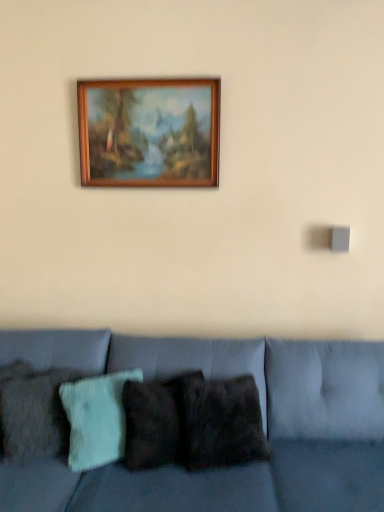
Question: Which direction should I rotate to face textured teal pillow at center, which appears as the second pillow when viewed from the left, — up or down?

Choices:
 (A) down
 (B) up

Answer: (A)

Question: Considering the relative positions of wooden picture frame at upper center and textured teal pillow at center, which appears as the second pillow when viewed from the left, in the image provided, is wooden picture frame at upper center behind textured teal pillow at center, which appears as the second pillow when viewed from the left,?

Choices:
 (A) yes
 (B) no

Answer: (A)

Question: From the image's perspective, is wooden picture frame at upper center beneath textured teal pillow at center, the 2th pillow in the right-to-left sequence?

Choices:
 (A) no
 (B) yes

Answer: (A)

Question: Can you confirm if wooden picture frame at upper center is taller than textured teal pillow at center, the 2th pillow in the right-to-left sequence?

Choices:
 (A) yes
 (B) no

Answer: (A)

Question: Does wooden picture frame at upper center turn towards textured teal pillow at center, the 2th pillow in the right-to-left sequence?

Choices:
 (A) yes
 (B) no

Answer: (B)

Question: From a real-world perspective, is wooden picture frame at upper center positioned over textured teal pillow at center, which appears as the second pillow when viewed from the left, based on gravity?

Choices:
 (A) no
 (B) yes

Answer: (B)

Question: Considering the relative sizes of wooden picture frame at upper center and textured teal pillow at center, which appears as the second pillow when viewed from the left, in the image provided, is wooden picture frame at upper center smaller than textured teal pillow at center, which appears as the second pillow when viewed from the left,?

Choices:
 (A) yes
 (B) no

Answer: (A)

Question: Would you say textured woolen pillow at left, acting as the third pillow starting from the right, contains velvet blue couch at lower center?

Choices:
 (A) no
 (B) yes

Answer: (A)

Question: Considering the relative sizes of textured woolen pillow at left, acting as the third pillow starting from the right, and velvet blue couch at lower center in the image provided, is textured woolen pillow at left, acting as the third pillow starting from the right, wider than velvet blue couch at lower center?

Choices:
 (A) yes
 (B) no

Answer: (B)

Question: From the image's perspective, would you say textured woolen pillow at left, positioned as the 1th pillow in left-to-right order, is positioned over velvet blue couch at lower center?

Choices:
 (A) yes
 (B) no

Answer: (A)

Question: Can you confirm if textured woolen pillow at left, positioned as the 1th pillow in left-to-right order, is bigger than velvet blue couch at lower center?

Choices:
 (A) no
 (B) yes

Answer: (A)

Question: Is textured woolen pillow at left, acting as the third pillow starting from the right, shorter than velvet blue couch at lower center?

Choices:
 (A) yes
 (B) no

Answer: (A)

Question: Are textured woolen pillow at left, acting as the third pillow starting from the right, and velvet blue couch at lower center far apart?

Choices:
 (A) yes
 (B) no

Answer: (B)

Question: Is dark brown textured pillow at center, which is the third pillow in left-to-right order, far from textured teal pillow at center, which appears as the second pillow when viewed from the left?

Choices:
 (A) no
 (B) yes

Answer: (A)